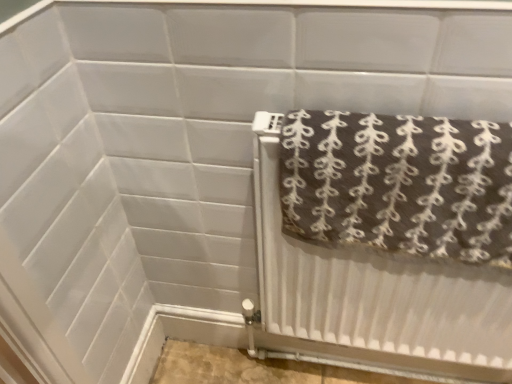
Locate an element on the screen. This screenshot has width=512, height=384. brown textured towel at right is located at coordinates (399, 183).

Image resolution: width=512 pixels, height=384 pixels. What do you see at coordinates (399, 183) in the screenshot?
I see `brown textured towel at right` at bounding box center [399, 183].

What is the approximate height of brown textured towel at right?

It is 10.45 inches.

Locate an element on the screen. brown textured towel at right is located at coordinates (399, 183).